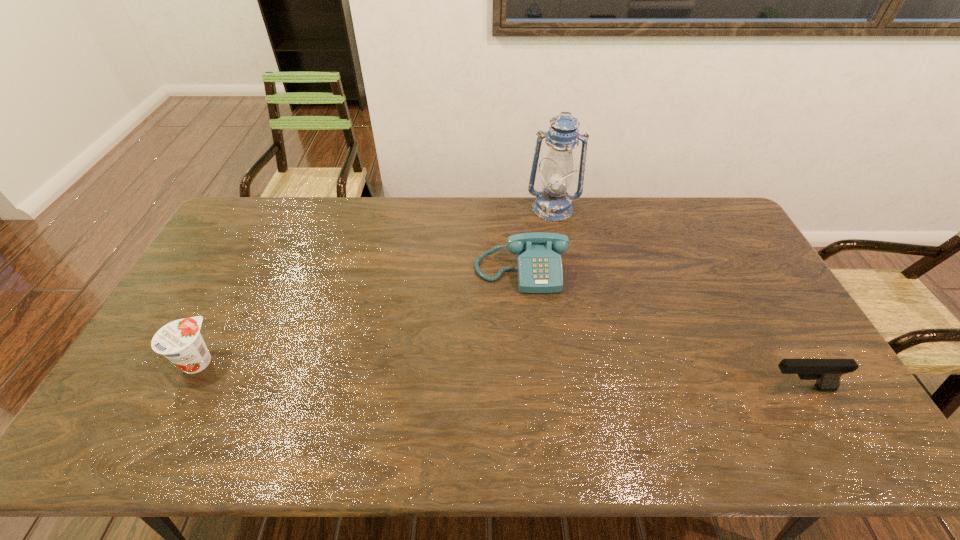
The image size is (960, 540). Find the location of `object that is at the left edge`. object that is at the left edge is located at coordinates (180, 341).

This screenshot has width=960, height=540. I want to click on object present at the right edge, so click(827, 372).

Locate an element on the screen. The image size is (960, 540). object that is positioned at the near left corner is located at coordinates (180, 341).

Where is `object present at the near right corner`? object present at the near right corner is located at coordinates (827, 372).

In the image, there is a desktop. Identify the location of vacant space at the far edge. The height and width of the screenshot is (540, 960). (337, 211).

Locate an element on the screen. The width and height of the screenshot is (960, 540). free location at the left edge is located at coordinates (224, 246).

Locate an element on the screen. Image resolution: width=960 pixels, height=540 pixels. vacant point at the right edge is located at coordinates pos(749,343).

Where is `vacant space at the far left corner of the desktop`? The height and width of the screenshot is (540, 960). vacant space at the far left corner of the desktop is located at coordinates (255, 225).

Find the location of a particular element. The width and height of the screenshot is (960, 540). free location at the near left corner of the desktop is located at coordinates (134, 384).

Locate an element on the screen. empty space that is in between the rightmost object and the third nearest object is located at coordinates (660, 329).